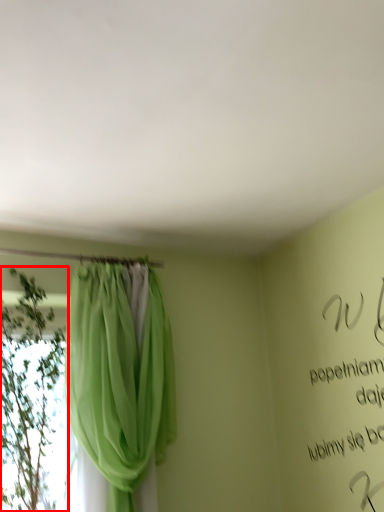
Question: From the image's perspective, considering the relative positions of plant (annotated by the red box) and curtain in the image provided, where is plant (annotated by the red box) located with respect to the staircase?

Choices:
 (A) below
 (B) above

Answer: (A)